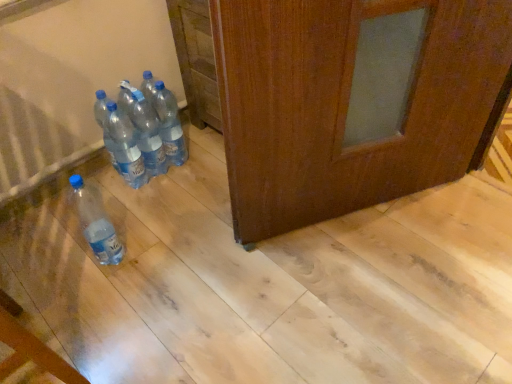
Question: Is transparent plastic bottles at center, which ranks as the 3th bottle in left-to-right order, facing away from transparent plastic bottles at center, acting as the 4th bottle starting from the left?

Choices:
 (A) yes
 (B) no

Answer: (B)

Question: Can you confirm if transparent plastic bottles at center, which ranks as the 3th bottle in left-to-right order, is bigger than transparent plastic bottles at center, the first bottle viewed from the right?

Choices:
 (A) no
 (B) yes

Answer: (A)

Question: Can you confirm if transparent plastic bottles at center, which ranks as the 3th bottle in left-to-right order, is taller than transparent plastic bottles at center, acting as the 4th bottle starting from the left?

Choices:
 (A) yes
 (B) no

Answer: (A)

Question: From the image's perspective, is transparent plastic bottles at center, which ranks as the 3th bottle in left-to-right order, above transparent plastic bottles at center, the first bottle viewed from the right?

Choices:
 (A) yes
 (B) no

Answer: (B)

Question: Can you confirm if transparent plastic bottles at center, which ranks as the 3th bottle in left-to-right order, is smaller than transparent plastic bottles at center, the first bottle viewed from the right?

Choices:
 (A) no
 (B) yes

Answer: (B)

Question: From a real-world perspective, is transparent plastic bottles at center, arranged as the 2th bottle when viewed from the right, positioned under transparent plastic bottles at center, acting as the 4th bottle starting from the left, based on gravity?

Choices:
 (A) yes
 (B) no

Answer: (B)

Question: Does transparent plastic bottles at center, arranged as the 2th bottle when viewed from the right, have a greater height compared to matte plastic bottle at lower left, which appears as the fourth bottle when viewed from the right?

Choices:
 (A) yes
 (B) no

Answer: (A)

Question: Does transparent plastic bottles at center, arranged as the 2th bottle when viewed from the right, contain matte plastic bottle at lower left, marked as the 1th bottle in a left-to-right arrangement?

Choices:
 (A) no
 (B) yes

Answer: (A)

Question: Can you confirm if transparent plastic bottles at center, arranged as the 2th bottle when viewed from the right, is smaller than matte plastic bottle at lower left, which appears as the fourth bottle when viewed from the right?

Choices:
 (A) no
 (B) yes

Answer: (B)

Question: Is matte plastic bottle at lower left, marked as the 1th bottle in a left-to-right arrangement, at the back of transparent plastic bottles at center, which ranks as the 3th bottle in left-to-right order?

Choices:
 (A) no
 (B) yes

Answer: (A)

Question: Is transparent plastic bottles at center, arranged as the 2th bottle when viewed from the right, facing towards matte plastic bottle at lower left, marked as the 1th bottle in a left-to-right arrangement?

Choices:
 (A) no
 (B) yes

Answer: (A)

Question: Does transparent plastic bottles at center, arranged as the 2th bottle when viewed from the right, come in front of matte plastic bottle at lower left, which appears as the fourth bottle when viewed from the right?

Choices:
 (A) yes
 (B) no

Answer: (B)

Question: From a real-world perspective, is clear plastic bottles at center, the second bottle from the left, below transparent plastic bottles at center, arranged as the 2th bottle when viewed from the right?

Choices:
 (A) yes
 (B) no

Answer: (A)